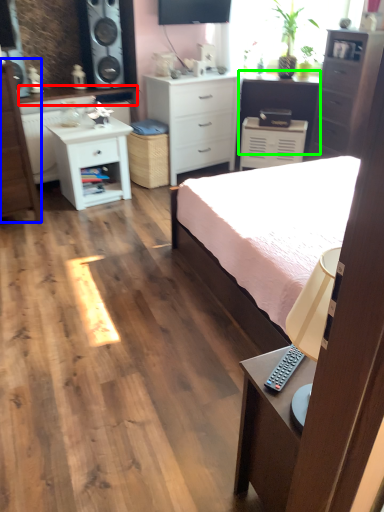
Question: Which is farther away from counter top (highlighted by a red box)? chest of drawers (highlighted by a blue box) or vanity (highlighted by a green box)?

Choices:
 (A) chest of drawers
 (B) vanity

Answer: (B)